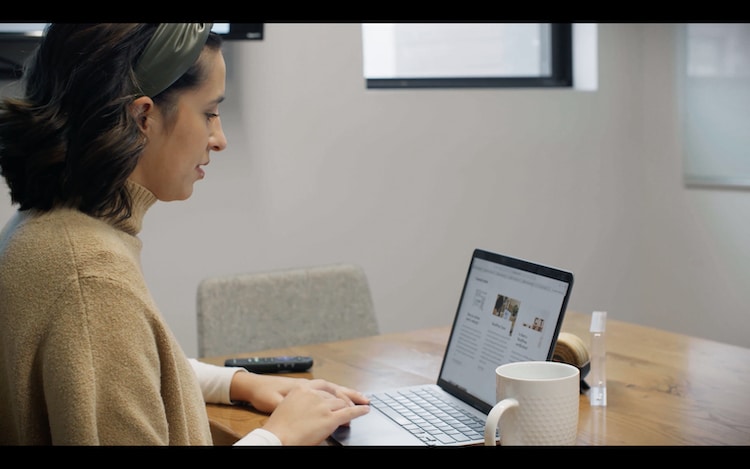
Find the location of a particular element. The height and width of the screenshot is (469, 750). mug is located at coordinates (538, 425).